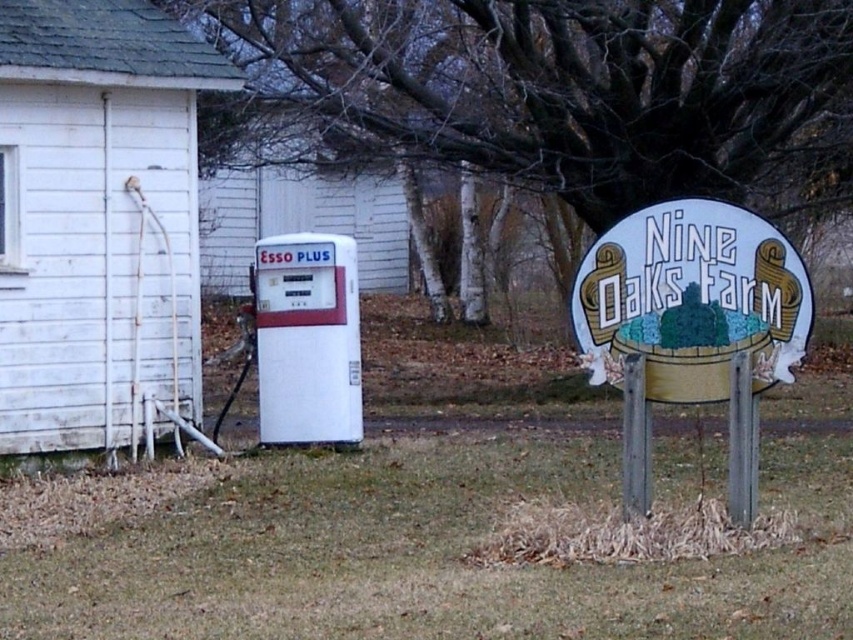
You are a delivery driver who needs to park your truck near the white matte gas pump at center and the white wooden sign at center right. According to the scene, where should you park your truck so that it doesn t block the entrance to Nine Oaks Farm? Please choose the best option based on the spatial arrangement.

The white matte gas pump at center is positioned under the white wooden sign at center right, so parking the truck to the left of the gas pump would keep the entrance clear while allowing access to both the pump and the sign.

You are a delivery driver who needs to park your truck near the gas pumps. You see two gas pumps in the image, the white matte gas pump at center and the white plastic gas pump at center. Which one is closer to you?

The white matte gas pump at center is closer to you because it is in front of the white plastic gas pump at center.

You are standing in front of the vintage gas pump and want to walk to the Nine Oaks Farm sign. Which point, point [404,445] or point [201,232], is closer to your current position?

Point [404,445] is closer to the camera than point [201,232], so it is closer to your current position.